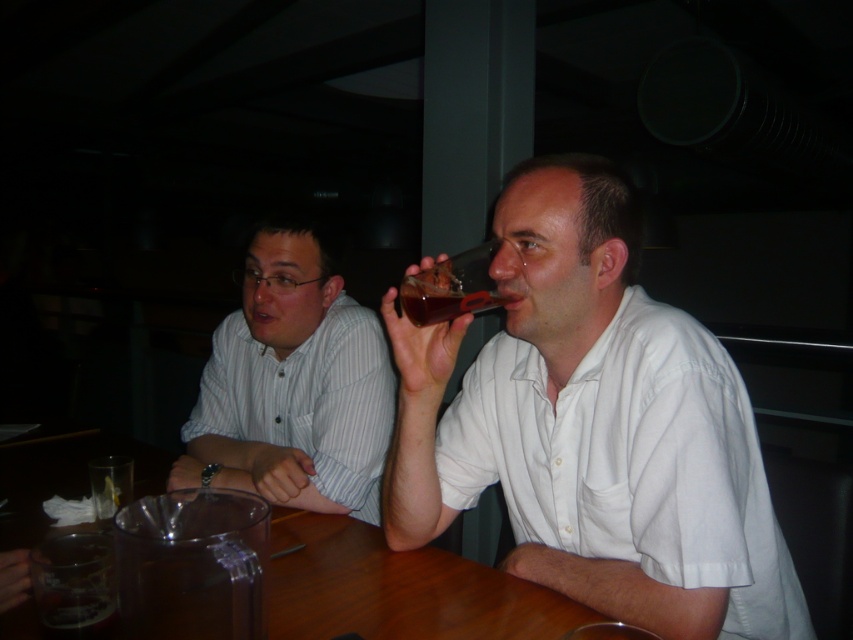
You are a fashion designer analyzing the clothing in the image. Which of the two shirts, the white cotton shirt at upper right or the white striped shirt at left, has a wider design?

The white cotton shirt at upper right has a wider design since its width surpasses that of the white striped shirt at left.

You are a photographer trying to capture a candid shot of the scene. You need to ensure that both the white striped shirt at left and the wooden table at center are clearly visible in the frame. Given their sizes, which object should you focus on first to ensure proper exposure?

The white striped shirt at left has a larger size compared to wooden table at center. Since it is larger, you should focus on the white striped shirt at left first to ensure proper exposure.

You are standing 2 meters away from the camera. You want to reach the point at coordinates point (331, 298). Will you have to move closer to the camera to reach it?

The point (331, 298) is 1.52 meters away from the camera. Since you are currently 2 meters away, you will need to move closer to the camera to reach it.